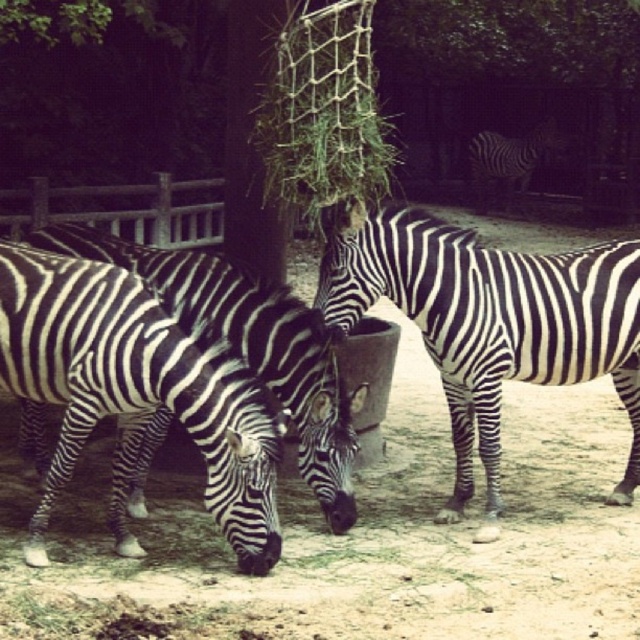
You are a zookeeper observing the zebras at the feeding station. You notice a point marked at coordinates (492, 321). Which zebra does this point correspond to?

A: The point at coordinates (492, 321) corresponds to the black and white striped zebra at center.

You are a zookeeper trying to feed the zebras. You have a bag of carrots that you want to place between the black and white striped zebra at center and the black and white stripes at center. Can you fit the bag there?

The distance between the black and white striped zebra at center and the black and white stripes at center is 13.12 meters. Since the bag of carrots is much smaller than this distance, you can easily place it there.

You are a zookeeper observing the zebras at the feeding station. You notice two zebras, the black and white striped zebra at lower left and the black and white striped zebra at center. Which zebra is positioned lower in the image?

The black and white striped zebra at lower left is positioned lower than the black and white striped zebra at center.